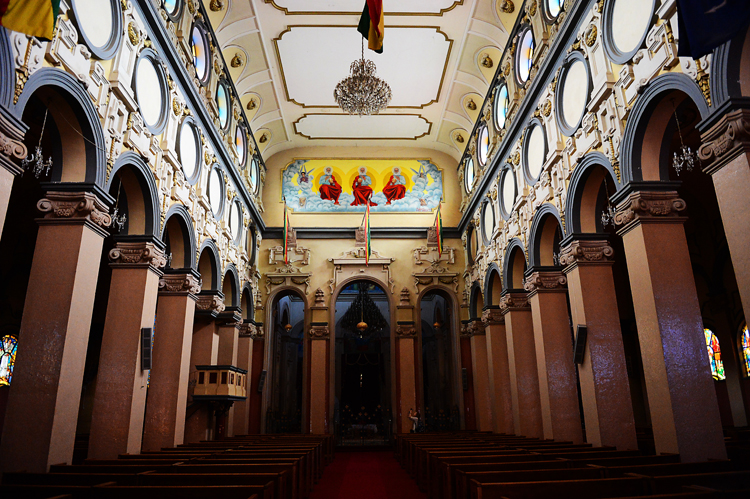
In order to click on benches in this screenshot , I will do `click(266, 472)`, `click(505, 452)`.